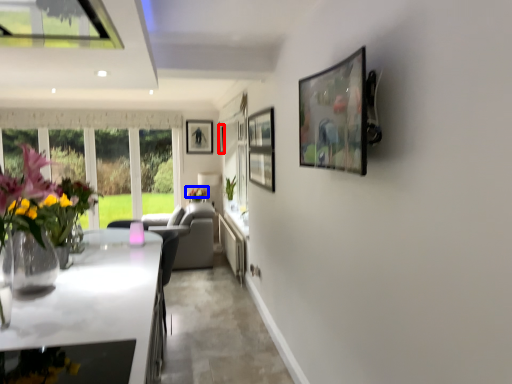
Question: Which object appears farthest to the camera in this image, picture frame (highlighted by a red box) or flower (highlighted by a blue box)?

Choices:
 (A) picture frame
 (B) flower

Answer: (A)